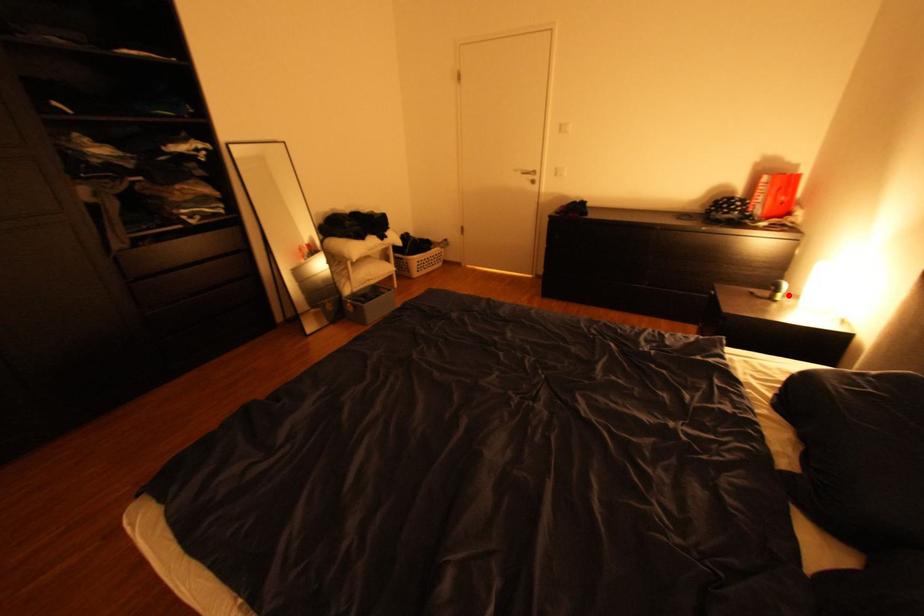
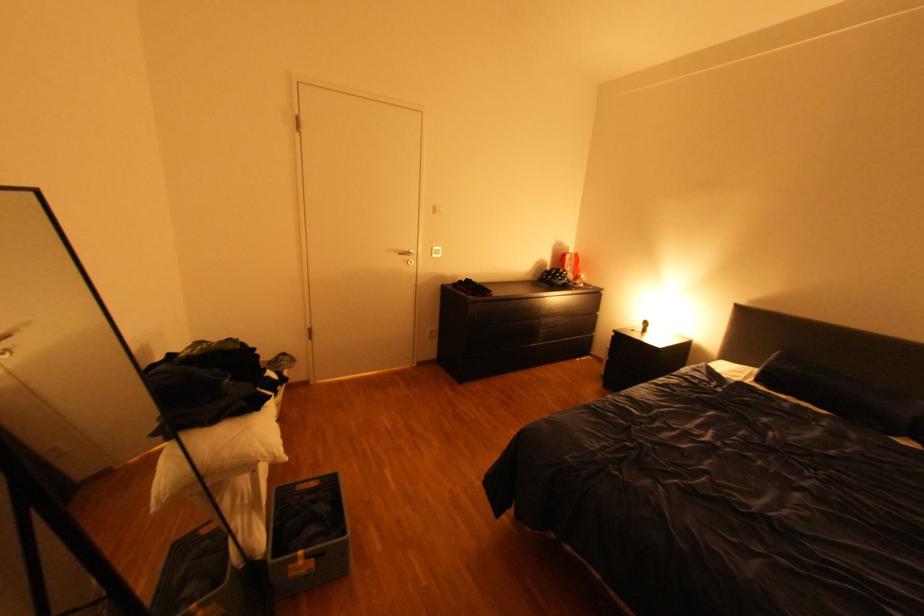
Where in the second image is the point corresponding to the highlighted location from the first image?

(659, 328)